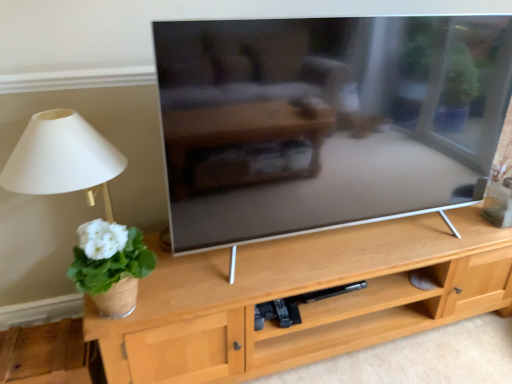
Identify the location of white fabric lampshade at left. The height and width of the screenshot is (384, 512). (87, 203).

What do you see at coordinates (87, 203) in the screenshot?
I see `white fabric lampshade at left` at bounding box center [87, 203].

Identify the location of white matte plant at left. (110, 266).

What is the approximate height of white matte plant at left?

white matte plant at left is 11.09 inches in height.

The height and width of the screenshot is (384, 512). What do you see at coordinates (110, 266) in the screenshot?
I see `white matte plant at left` at bounding box center [110, 266].

Find the location of a particular element. Image resolution: width=512 pixels, height=384 pixels. white fabric lampshade at left is located at coordinates (87, 203).

Looking at this image, between white fabric lampshade at left and white matte plant at left, which one appears on the right side from the viewer's perspective?

white matte plant at left.

Is white fabric lampshade at left positioned behind white matte plant at left?

Yes, white fabric lampshade at left is further from the camera.

Which is closer, (93,299) or (120,310)?

Point (93,299) is farther from the camera than point (120,310).

From the image's perspective, which one is positioned lower, white fabric lampshade at left or white matte plant at left?

white matte plant at left, from the image's perspective.

In the scene shown: From a real-world perspective, is white fabric lampshade at left over white matte plant at left?

Indeed, from a real-world perspective, white fabric lampshade at left stands above white matte plant at left.

Does white fabric lampshade at left have a lesser width compared to white matte plant at left?

No, white fabric lampshade at left is not thinner than white matte plant at left.

From the picture: Which of these two, white fabric lampshade at left or white matte plant at left, stands shorter?

white matte plant at left.

Between white fabric lampshade at left and white matte plant at left, which one has larger size?

Bigger between the two is white fabric lampshade at left.

Choose the correct answer: Is white fabric lampshade at left inside white matte plant at left or outside it?

white fabric lampshade at left cannot be found inside white matte plant at left.

In the scene shown: Is white fabric lampshade at left in contact with white matte plant at left?

Yes, white fabric lampshade at left is right next to white matte plant at left and making contact.

In the scene shown: Is white matte plant at left at the back of white fabric lampshade at left?

white fabric lampshade at left does not have its back to white matte plant at left.

How many degrees apart are the facing directions of white fabric lampshade at left and white matte plant at left?

They differ by 0.000356 degrees in their facing directions.

Where is `table lamp to the left of white matte plant at left`? table lamp to the left of white matte plant at left is located at coordinates (87, 203).

From the picture: Which object is positioned more to the left, white matte plant at left or white fabric lampshade at left?

Positioned to the left is white fabric lampshade at left.

Which object is further away from the camera, white matte plant at left or white fabric lampshade at left?

white fabric lampshade at left.

Does point (71, 276) come in front of point (115, 309)?

No.

From the image's perspective, is white matte plant at left above white fabric lampshade at left?

Actually, white matte plant at left appears below white fabric lampshade at left in the image.

From a real-world perspective, is white matte plant at left above or below white fabric lampshade at left?

white matte plant at left is situated lower than white fabric lampshade at left in the real world.

Considering the sizes of objects white matte plant at left and white fabric lampshade at left in the image provided, who is wider, white matte plant at left or white fabric lampshade at left?

white fabric lampshade at left.

Does white matte plant at left have a greater height compared to white fabric lampshade at left?

No, white matte plant at left is not taller than white fabric lampshade at left.

In the scene shown: Does white matte plant at left have a larger size compared to white fabric lampshade at left?

Incorrect, white matte plant at left is not larger than white fabric lampshade at left.

In the scene shown: Is white matte plant at left not within white fabric lampshade at left?

white matte plant at left is positioned outside white fabric lampshade at left.

Is white matte plant at left not close to white fabric lampshade at left?

No, white matte plant at left is not far from white fabric lampshade at left.

Is white matte plant at left positioned with its back to white fabric lampshade at left?

Yes, white matte plant at left is facing away from white fabric lampshade at left.

How many degrees apart are the facing directions of white matte plant at left and white fabric lampshade at left?

There is a 0.000356-degree angle between the facing directions of white matte plant at left and white fabric lampshade at left.

Where is `table lamp above the white matte plant at left (from a real-world perspective)`? table lamp above the white matte plant at left (from a real-world perspective) is located at coordinates (87, 203).

Locate an element on the screen. Image resolution: width=512 pixels, height=384 pixels. table lamp above the white matte plant at left (from the image's perspective) is located at coordinates (87, 203).

Find the location of a particular element. The width and height of the screenshot is (512, 384). houseplant in front of the white fabric lampshade at left is located at coordinates (110, 266).